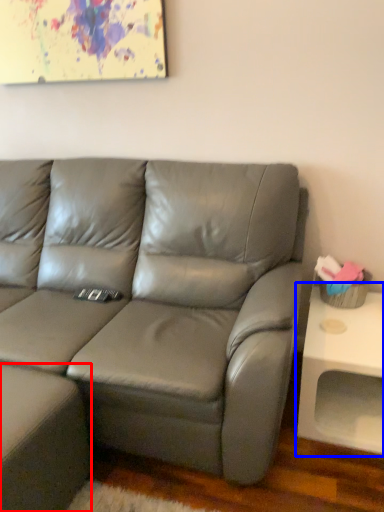
Question: Which of the following is the closest to the observer, footrest (highlighted by a red box) or table (highlighted by a blue box)?

Choices:
 (A) footrest
 (B) table

Answer: (A)